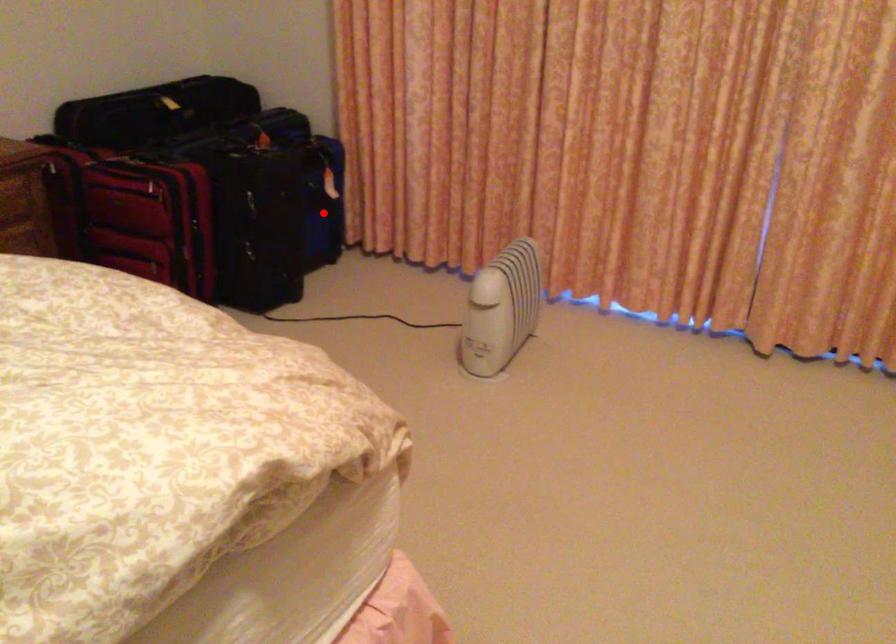
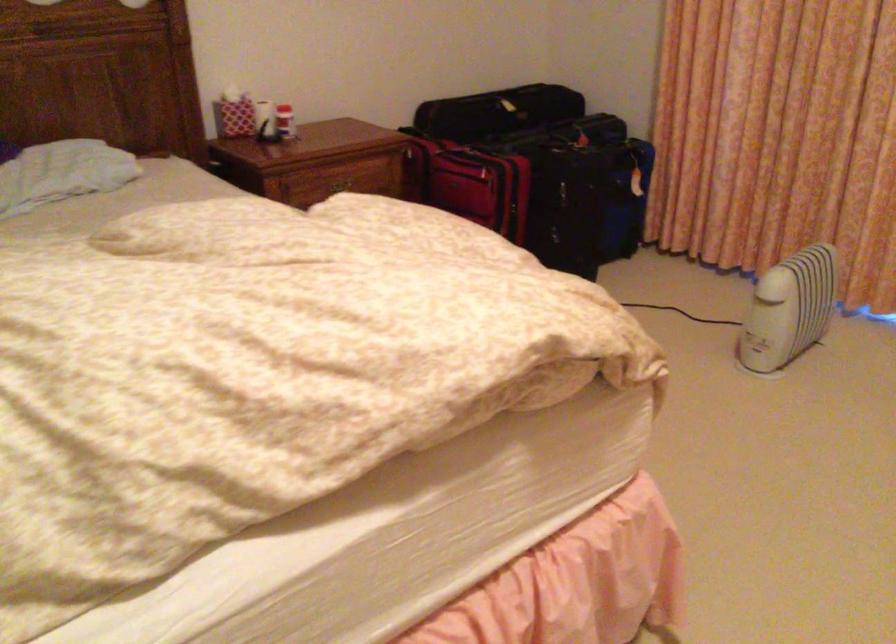
In the second image, find the point that corresponds to the highlighted location in the first image.

(625, 199)